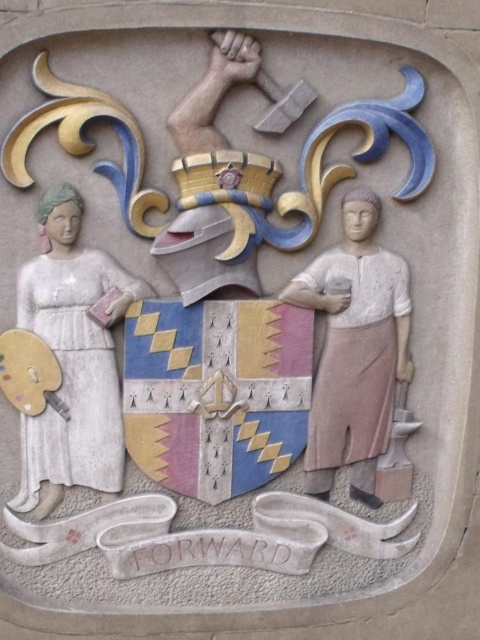
You are an art conservator examining the relief sculpture. You notice a specific point at coordinates (72, 358). Based on the scene description, what object or part of the scene does this coordinate point to?

The point at coordinates (72, 358) corresponds to the smooth white dress at left.

Based on the scene described, which object is positioned lower in the relief sculpture? The smooth white dress at left or the stone figure at center?

The smooth white dress at left is located below the stone figure at center, so it is positioned lower in the relief sculpture.

Based on the scene described, which object is taller between the smooth white dress at left and the stone figure at center?

The smooth white dress at left is taller than the stone figure at center according to the description.